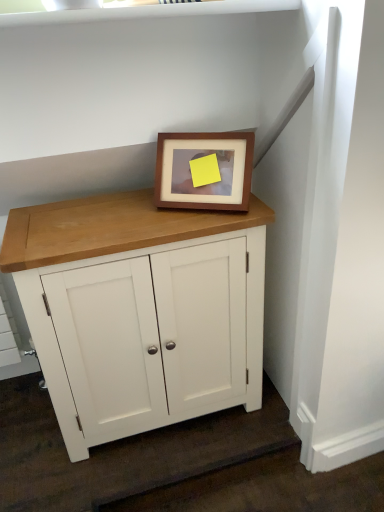
Question: Based on their positions, is white painted wood cabinet at center located to the left or right of wooden picture frame at center?

Choices:
 (A) right
 (B) left

Answer: (B)

Question: Is white painted wood cabinet at center spatially inside wooden picture frame at center, or outside of it?

Choices:
 (A) inside
 (B) outside

Answer: (B)

Question: From the image's perspective, is white painted wood cabinet at center above or below wooden picture frame at center?

Choices:
 (A) above
 (B) below

Answer: (B)

Question: In terms of size, does wooden picture frame at center appear bigger or smaller than white painted wood cabinet at center?

Choices:
 (A) small
 (B) big

Answer: (A)

Question: Do you think wooden picture frame at center is within white painted wood cabinet at center, or outside of it?

Choices:
 (A) outside
 (B) inside

Answer: (A)

Question: In terms of width, does wooden picture frame at center look wider or thinner when compared to white painted wood cabinet at center?

Choices:
 (A) wide
 (B) thin

Answer: (B)

Question: From a real-world perspective, is wooden picture frame at center positioned above or below white painted wood cabinet at center?

Choices:
 (A) below
 (B) above

Answer: (B)